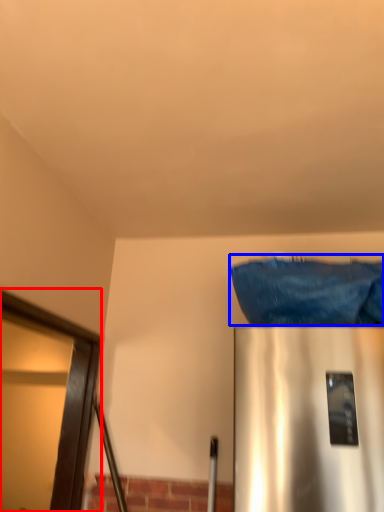
Question: Which object is further to the camera taking this photo, glass door (highlighted by a red box) or material (highlighted by a blue box)?

Choices:
 (A) glass door
 (B) material

Answer: (B)